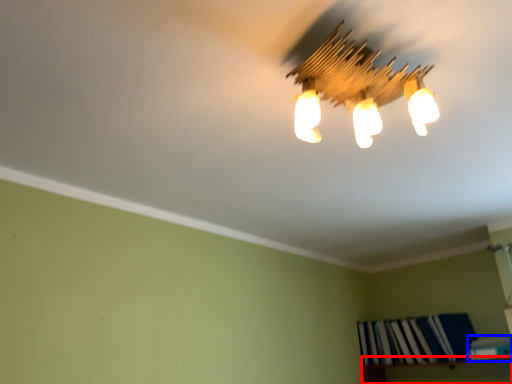
Question: Which object is closer to the camera taking this photo, shelf (highlighted by a red box) or book (highlighted by a blue box)?

Choices:
 (A) shelf
 (B) book

Answer: (A)